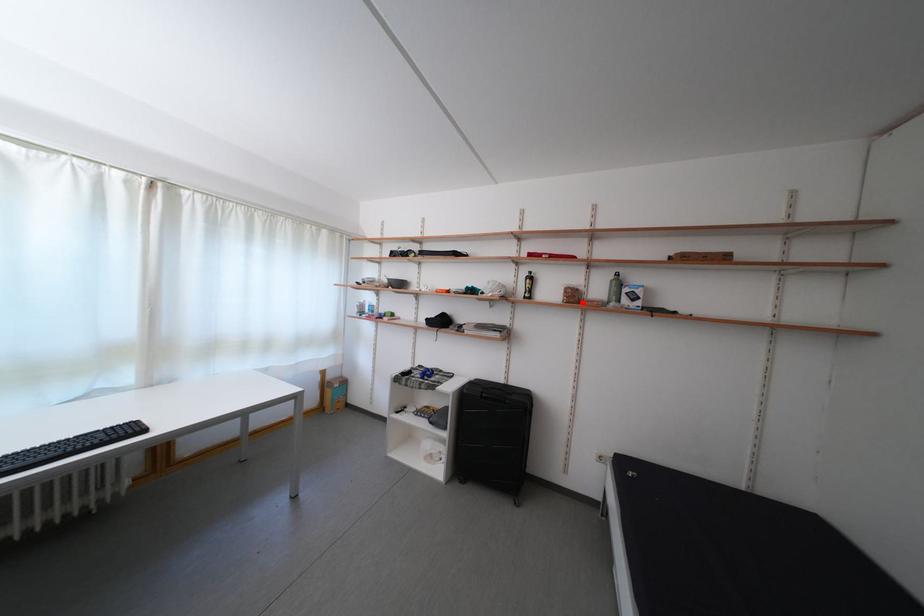
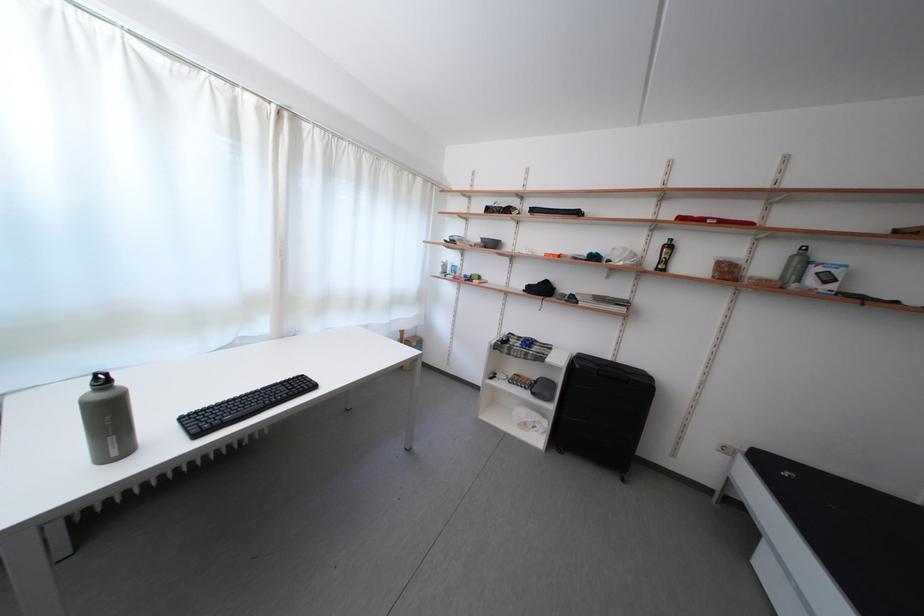
In the second image, find the point that corresponds to the highlighted location in the first image.

(736, 278)